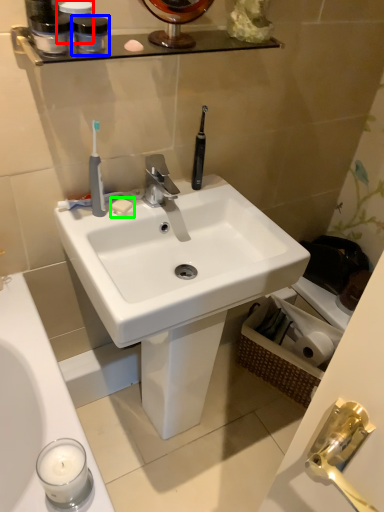
Question: Which object is the closest to the toiletry (highlighted by a red box)? Choose among these: mouthwash (highlighted by a blue box) or soap (highlighted by a green box).

Choices:
 (A) mouthwash
 (B) soap

Answer: (A)